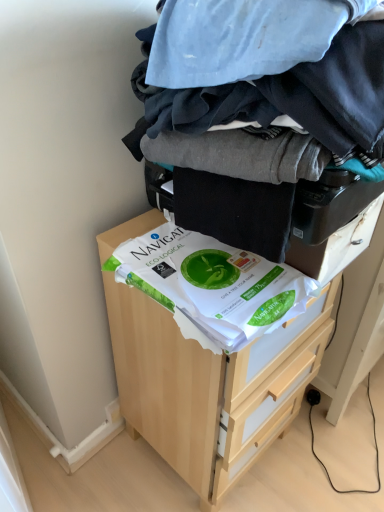
The width and height of the screenshot is (384, 512). What are the coordinates of `light wood chest of drawers at center` in the screenshot? It's located at (208, 387).

The height and width of the screenshot is (512, 384). Identify the location of dark blue cotton laundry at center. (262, 136).

You are a GUI agent. You are given a task and a screenshot of the screen. Output one action in this format:
    pyautogui.click(x=<x>, y=<y>)
    Task: Click on the laundry located above the white paper at center (from the image's perspective)
    
    Given the screenshot: What is the action you would take?
    pyautogui.click(x=262, y=136)

Can you confirm if white paper at center is bigger than dark blue cotton laundry at center?

No, white paper at center is not bigger than dark blue cotton laundry at center.

Is white paper at center placed right next to dark blue cotton laundry at center?

white paper at center and dark blue cotton laundry at center are not in contact.

Considering the sizes of objects white paper at center and dark blue cotton laundry at center in the image provided, who is wider, white paper at center or dark blue cotton laundry at center?

dark blue cotton laundry at center is wider.

What's the angular difference between light wood chest of drawers at center and white paper at center's facing directions?

0.504 degrees.

From the image's perspective, is light wood chest of drawers at center positioned above or below white paper at center?

Based on their image positions, light wood chest of drawers at center is located beneath white paper at center.

Is light wood chest of drawers at center at the right side of white paper at center?

Indeed, light wood chest of drawers at center is positioned on the right side of white paper at center.

Is light wood chest of drawers at center situated inside white paper at center or outside?

light wood chest of drawers at center is located beyond the bounds of white paper at center.

How many degrees apart are the facing directions of dark blue cotton laundry at center and white paper at center?

There is a 0.29-degree angle between the facing directions of dark blue cotton laundry at center and white paper at center.

Considering their positions, is dark blue cotton laundry at center located in front of or behind white paper at center?

Clearly, dark blue cotton laundry at center is in front of white paper at center.

Is dark blue cotton laundry at center far from white paper at center?

No, dark blue cotton laundry at center is in close proximity to white paper at center.

Is light wood chest of drawers at center at the back of dark blue cotton laundry at center?

No.

From a real-world perspective, relative to light wood chest of drawers at center, is dark blue cotton laundry at center vertically above or below?

In terms of real-world spatial position, dark blue cotton laundry at center is above light wood chest of drawers at center.

Is dark blue cotton laundry at center shorter than light wood chest of drawers at center?

Yes.

Could you tell me if white paper at center is facing light wood chest of drawers at center?

No, white paper at center is not aimed at light wood chest of drawers at center.

Is white paper at center not close to light wood chest of drawers at center?

That's not correct — white paper at center is a little close to light wood chest of drawers at center.

In order to click on food above the light wood chest of drawers at center (from the image's perspective) in this screenshot , I will do `click(211, 285)`.

Considering the sizes of objects white paper at center and light wood chest of drawers at center in the image provided, who is bigger, white paper at center or light wood chest of drawers at center?

Bigger between the two is light wood chest of drawers at center.

Does point (193, 459) come closer to viewer compared to point (192, 141)?

That is False.

Considering the relative sizes of light wood chest of drawers at center and dark blue cotton laundry at center in the image provided, is light wood chest of drawers at center thinner than dark blue cotton laundry at center?

Yes.

Does light wood chest of drawers at center have a greater height compared to dark blue cotton laundry at center?

Yes, light wood chest of drawers at center is taller than dark blue cotton laundry at center.

The height and width of the screenshot is (512, 384). I want to click on laundry located in front of the light wood chest of drawers at center, so click(x=262, y=136).

In order to click on laundry on the right of white paper at center in this screenshot , I will do `click(262, 136)`.

In order to click on the chest of drawers that appears below the white paper at center (from a real-world perspective) in this screenshot , I will do `click(208, 387)`.

When comparing their distances from white paper at center, does dark blue cotton laundry at center or light wood chest of drawers at center seem further?

light wood chest of drawers at center lies further to white paper at center than the other object.

From the image, which object appears to be nearer to dark blue cotton laundry at center, white paper at center or light wood chest of drawers at center?

white paper at center is closer to dark blue cotton laundry at center.

Considering their positions, is light wood chest of drawers at center positioned closer to white paper at center than dark blue cotton laundry at center?

Among the two, dark blue cotton laundry at center is located nearer to white paper at center.

Which object lies nearer to the anchor point light wood chest of drawers at center, white paper at center or dark blue cotton laundry at center?

white paper at center is closer to light wood chest of drawers at center.

Considering their positions, is light wood chest of drawers at center positioned closer to dark blue cotton laundry at center than white paper at center?

Based on the image, white paper at center appears to be nearer to dark blue cotton laundry at center.

When comparing their distances from light wood chest of drawers at center, does dark blue cotton laundry at center or white paper at center seem further?

dark blue cotton laundry at center.

This screenshot has width=384, height=512. I want to click on food between dark blue cotton laundry at center and light wood chest of drawers at center vertically, so click(x=211, y=285).